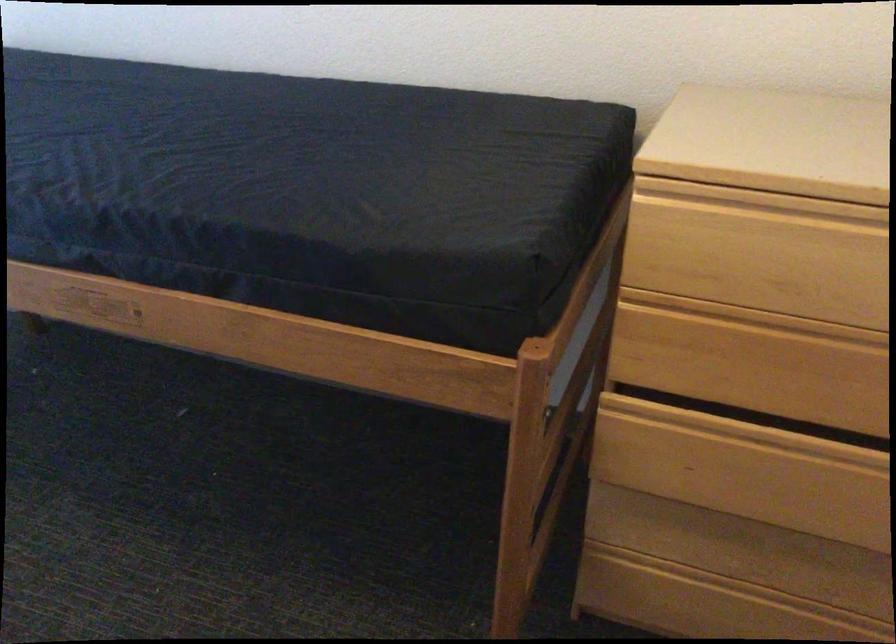
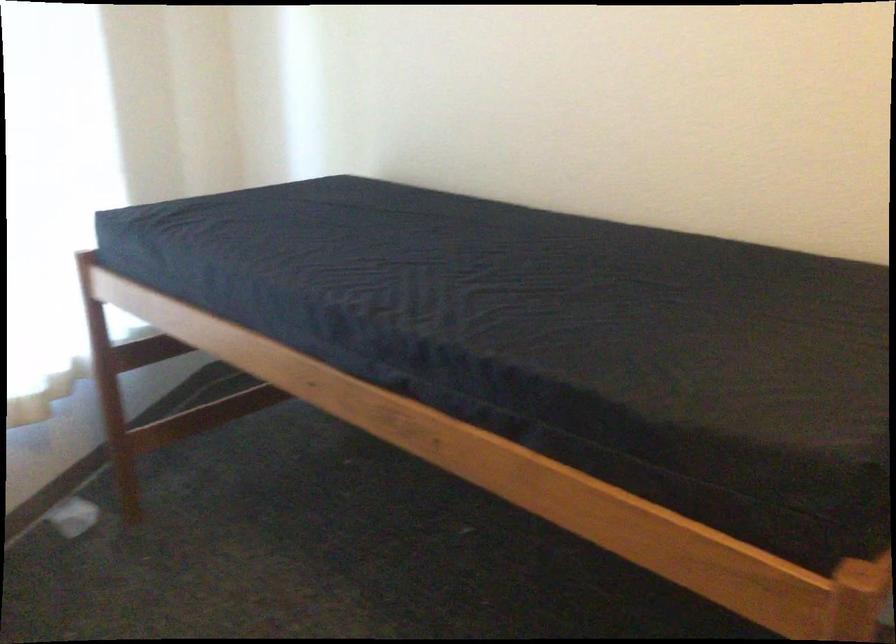
Question: The images are taken continuously from a first-person perspective. In which direction is your viewpoint rotating?

Choices:
 (A) Left
 (B) Right
 (C) Up
 (D) Down

Answer: (A)